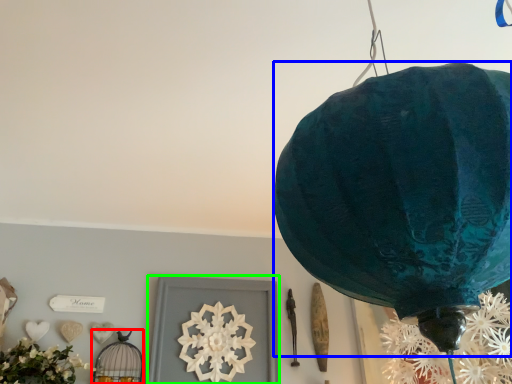
Question: Based on their relative distances, which object is farther from lamp (highlighted by a red box)? Choose from lantern (highlighted by a blue box) and picture frame (highlighted by a green box).

Choices:
 (A) lantern
 (B) picture frame

Answer: (A)